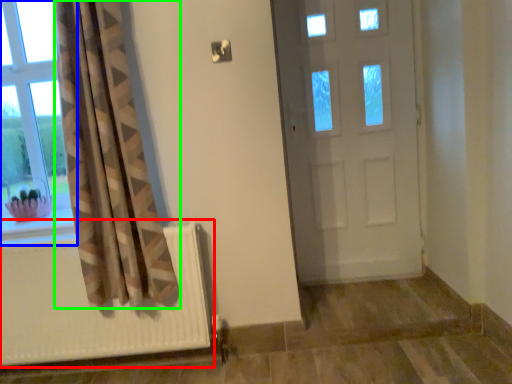
Question: Which object is the closest to the radiator (highlighted by a red box)? Choose among these: window (highlighted by a blue box) or curtain (highlighted by a green box).

Choices:
 (A) window
 (B) curtain

Answer: (B)